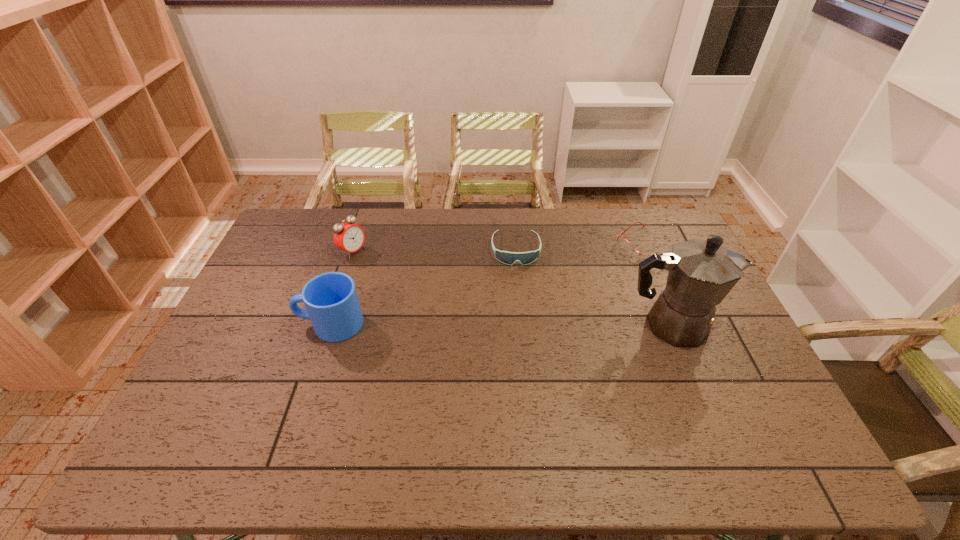
The image size is (960, 540). Find the location of `vacant space on the desktop that is between the mug and the coffeepot and is positioned on the front-facing side of the fourth tallest object`. vacant space on the desktop that is between the mug and the coffeepot and is positioned on the front-facing side of the fourth tallest object is located at coordinates (522, 325).

You are a GUI agent. You are given a task and a screenshot of the screen. Output one action in this format:
    pyautogui.click(x=<x>, y=<y>)
    Task: Click on the vacant space on the desktop that is between the mug and the coffeepot and is positioned on the lenses of the shortest object
    
    Given the screenshot: What is the action you would take?
    pyautogui.click(x=541, y=325)

What are the coordinates of `free spot on the desktop that is between the mug and the coffeepot and is positioned on the front-facing side of the alarm clock` in the screenshot? It's located at (491, 325).